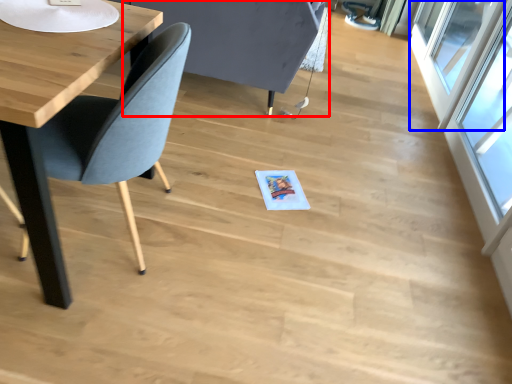
Question: Which object appears closest to the camera in this image, swivel chair (highlighted by a red box) or window (highlighted by a blue box)?

Choices:
 (A) swivel chair
 (B) window

Answer: (A)